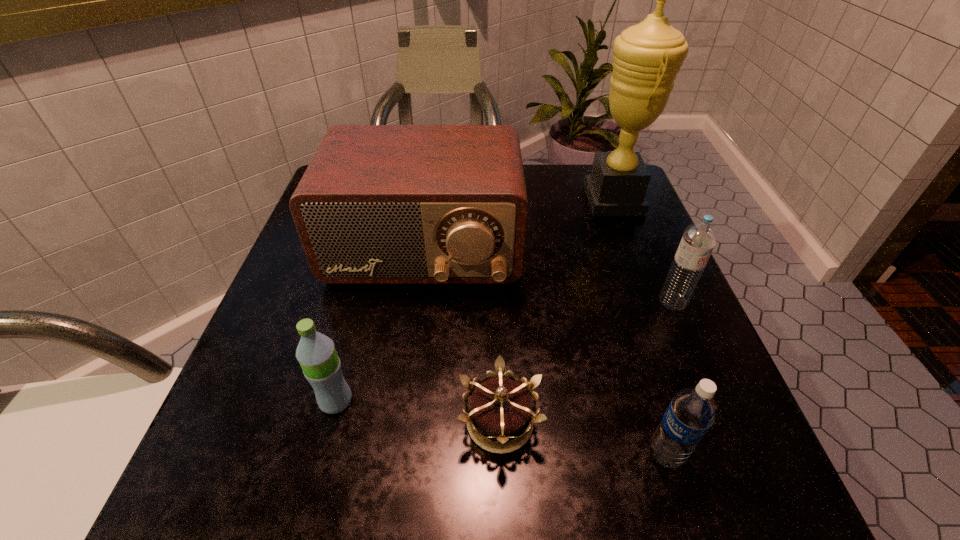
At what (x,y) coordinates should I click in order to perform the action: click on trophy cup located at the right edge. Please return your answer as a coordinate pair (x, y). Looking at the image, I should click on (647, 57).

You are a GUI agent. You are given a task and a screenshot of the screen. Output one action in this format:
    pyautogui.click(x=<x>, y=<y>)
    Task: Click on the object present at the far left corner
    This screenshot has height=540, width=960.
    Given the screenshot: What is the action you would take?
    pyautogui.click(x=378, y=204)

Find the location of a particular element. object located in the far right corner section of the desktop is located at coordinates (647, 57).

Find the location of a particular element. This screenshot has width=960, height=540. object that is at the near right corner is located at coordinates (693, 410).

I want to click on vacant space at the far edge of the desktop, so click(x=544, y=207).

Where is `free space at the near edge`? This screenshot has height=540, width=960. free space at the near edge is located at coordinates (527, 476).

Locate an element on the screen. The height and width of the screenshot is (540, 960). free region at the left edge of the desktop is located at coordinates (305, 279).

The width and height of the screenshot is (960, 540). In order to click on vacant space at the right edge of the desktop in this screenshot , I will do `click(625, 242)`.

This screenshot has height=540, width=960. I want to click on free spot at the near left corner of the desktop, so [201, 485].

Image resolution: width=960 pixels, height=540 pixels. I want to click on empty location between the nearest water bottle and the radio receiver, so click(545, 352).